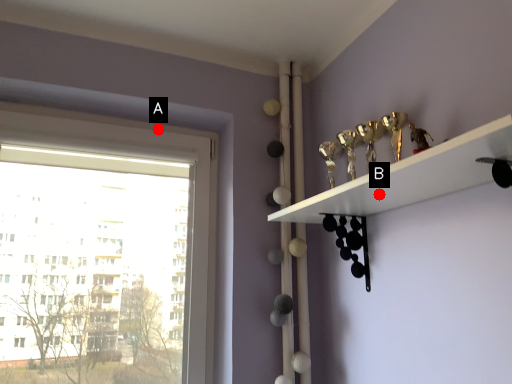
Question: Two points are circled on the image, labeled by A and B beside each circle. Which point is closer to the camera taking this photo?

Choices:
 (A) A is closer
 (B) B is closer

Answer: (B)